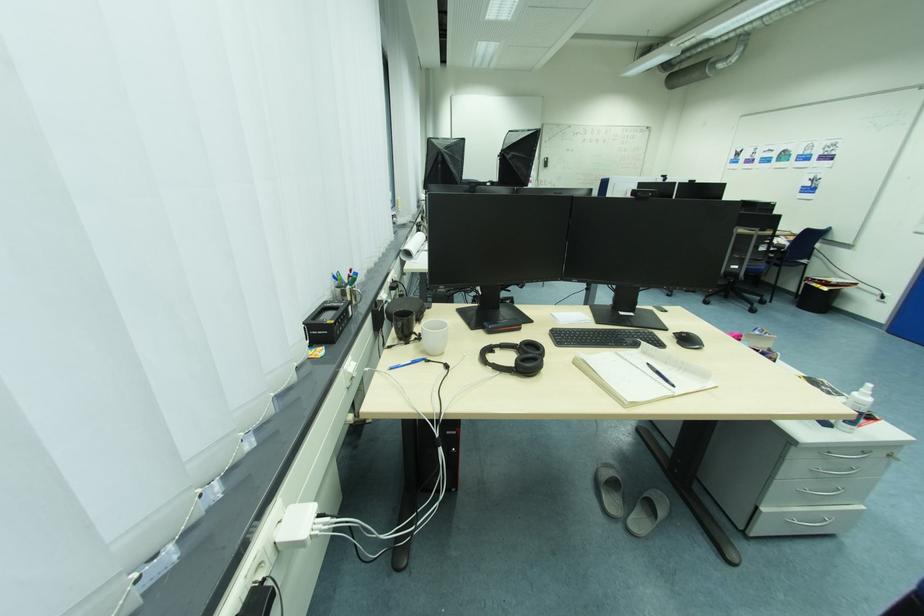
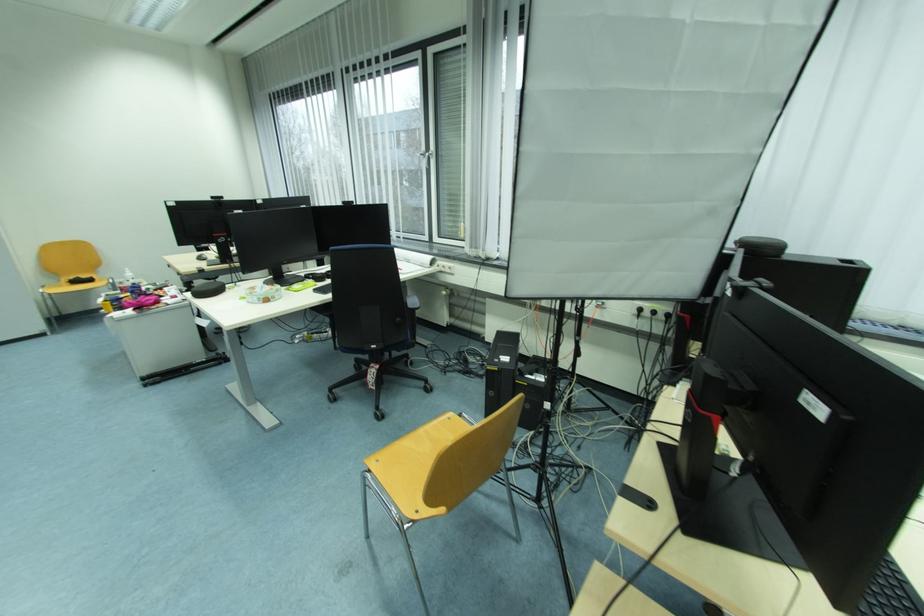
Question: I am providing you with two images of the same scene from different viewpoints. After the viewpoint changes to image2, which objects are now occluded?

Choices:
 (A) yellow chair sitting surface
 (B) dragon figurine
 (C) grey slipper
 (D) power strip switch

Answer: (C)